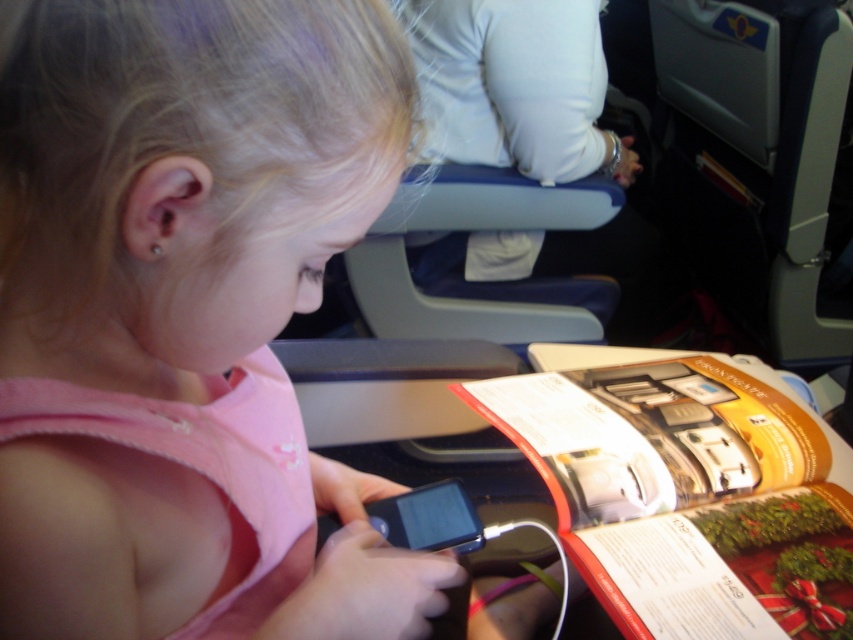
Looking at this image, between pink fabric girl at center and orange glossy magazine at lower right, which one appears on the left side from the viewer's perspective?

pink fabric girl at center is more to the left.

Who is taller, pink fabric girl at center or orange glossy magazine at lower right?

pink fabric girl at center

Is point (45, 138) more distant than point (691, 420)?

No, it is in front of (691, 420).

You are a GUI agent. You are given a task and a screenshot of the screen. Output one action in this format:
    pyautogui.click(x=<x>, y=<y>)
    Task: Click on the pink fabric girl at center
    This screenshot has height=640, width=853.
    Given the screenshot: What is the action you would take?
    point(183,179)